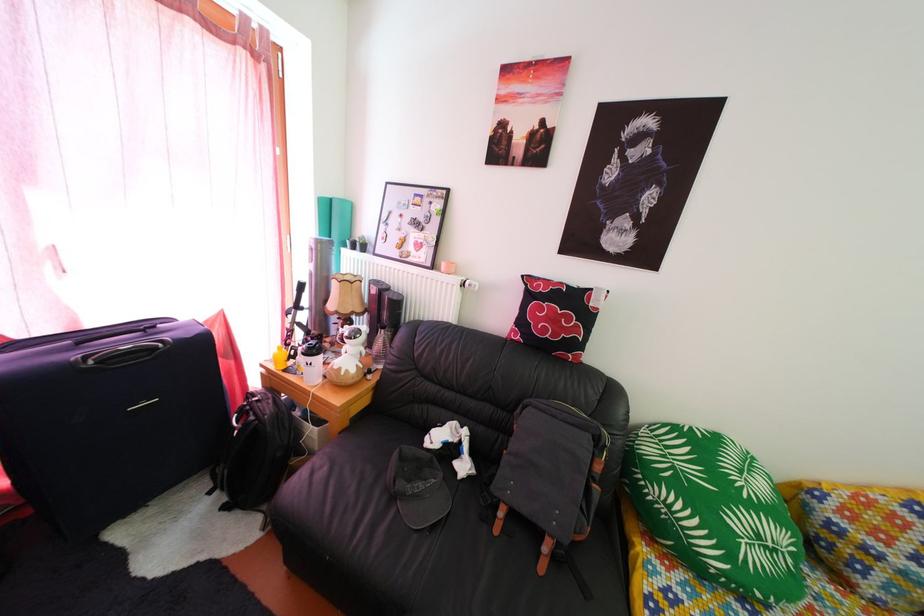
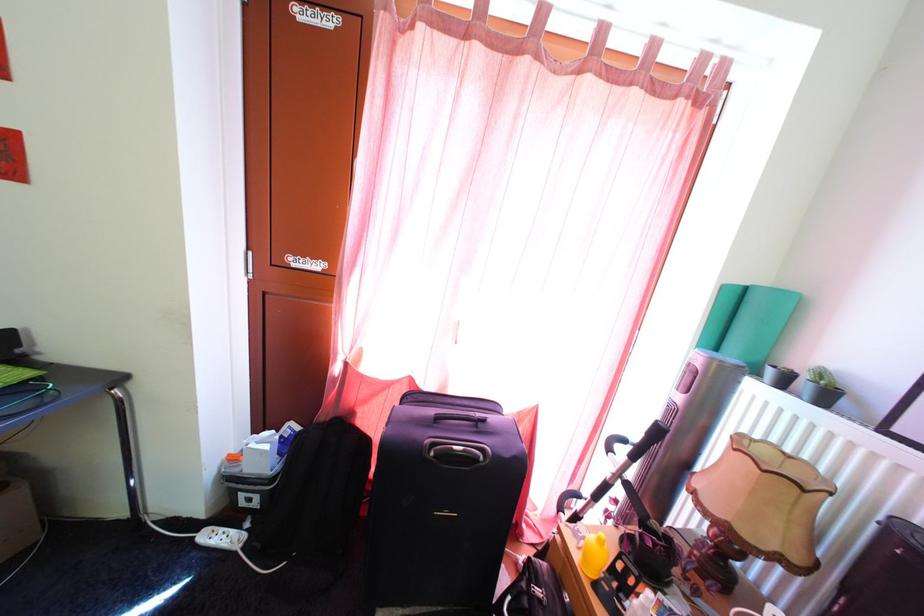
The point at (96,365) is marked in the first image. Where is the corresponding point in the second image?

(441, 454)